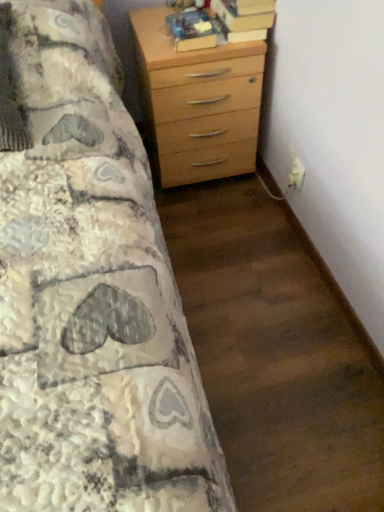
The image size is (384, 512). What are the coordinates of `free space in front of hardcover book at upper center, marked as the second book in a right-to-left arrangement` in the screenshot? It's located at (190, 54).